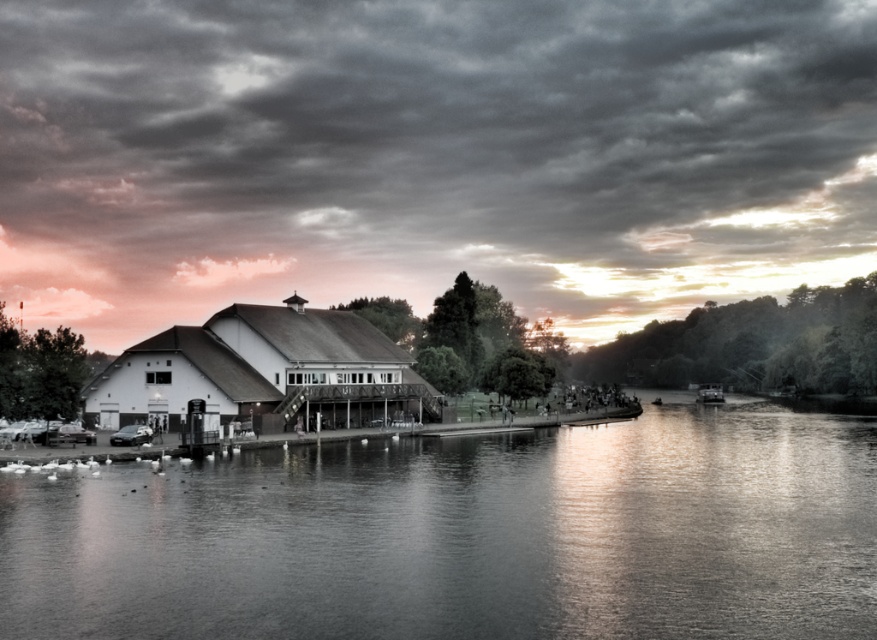
Is point (708, 272) positioned after point (266, 593)?

Yes, point (708, 272) is farther from viewer.

Identify the location of cloudy sky at upper center. Image resolution: width=877 pixels, height=640 pixels. (430, 154).

Which of these two, smooth water at center or metallic silver boat at right, stands shorter?

metallic silver boat at right is shorter.

Is smooth water at center bigger than metallic silver boat at right?

Yes.

Is point (454, 440) positioned in front of point (706, 401)?

Yes, point (454, 440) is in front of point (706, 401).

Identify the location of smooth water at center. Image resolution: width=877 pixels, height=640 pixels. (465, 536).

Can you confirm if cloudy sky at upper center is positioned below metallic silver boat at right?

No.

Between cloudy sky at upper center and metallic silver boat at right, which one is positioned lower?

metallic silver boat at right is lower down.

Where is `cloudy sky at upper center`? The image size is (877, 640). cloudy sky at upper center is located at coordinates (430, 154).